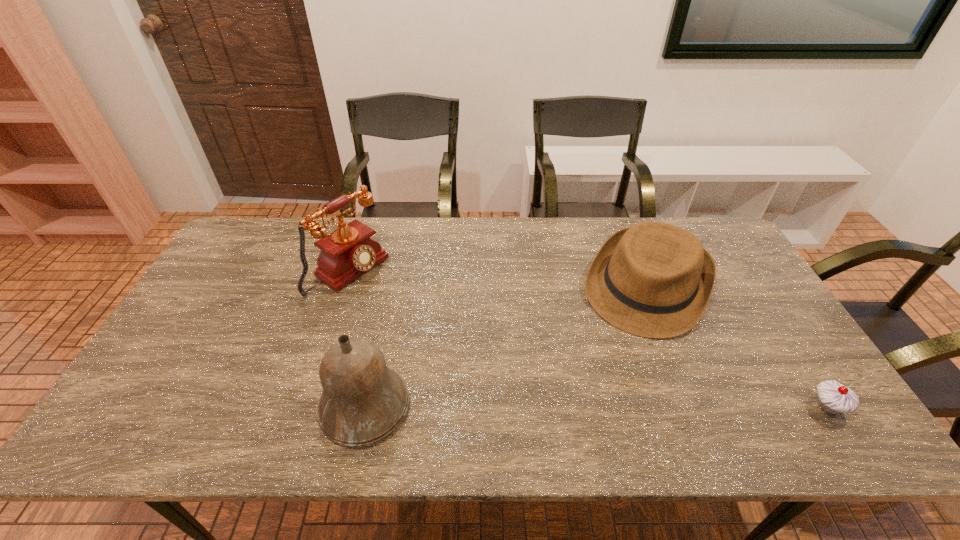
In order to click on bell in this screenshot , I will do `click(363, 401)`.

You are a GUI agent. You are given a task and a screenshot of the screen. Output one action in this format:
    pyautogui.click(x=<x>, y=<y>)
    Task: Click on the rightmost object
    
    Given the screenshot: What is the action you would take?
    pyautogui.click(x=833, y=398)

The width and height of the screenshot is (960, 540). Find the location of `the shortest object`. the shortest object is located at coordinates (833, 398).

Where is `the second object from right to left`? This screenshot has width=960, height=540. the second object from right to left is located at coordinates (653, 279).

At what (x,y) coordinates should I click in order to perform the action: click on telephone. Please return your answer as a coordinate pair (x, y). The image size is (960, 540). Looking at the image, I should click on (347, 253).

The width and height of the screenshot is (960, 540). I want to click on free region located 0.130m on the back of the bell, so click(381, 330).

In order to click on vacant region located on the back of the cupcake in this screenshot , I will do `click(748, 282)`.

The image size is (960, 540). Identify the location of free space located 0.280m on the front-facing side of the second object from right to left. (589, 408).

I want to click on vacant area located 0.090m on the front-facing side of the second object from right to left, so click(x=616, y=354).

You are a GUI agent. You are given a task and a screenshot of the screen. Output one action in this format:
    pyautogui.click(x=<x>, y=<y>)
    Task: Click on the vacant area situated on the front-facing side of the second object from right to left
    The image size is (960, 540).
    Given the screenshot: What is the action you would take?
    pyautogui.click(x=621, y=343)